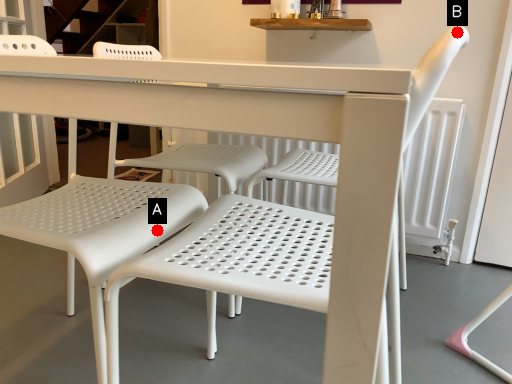
Question: Two points are circled on the image, labeled by A and B beside each circle. Which point appears farthest from the camera in this image?

Choices:
 (A) A is further
 (B) B is further

Answer: (A)